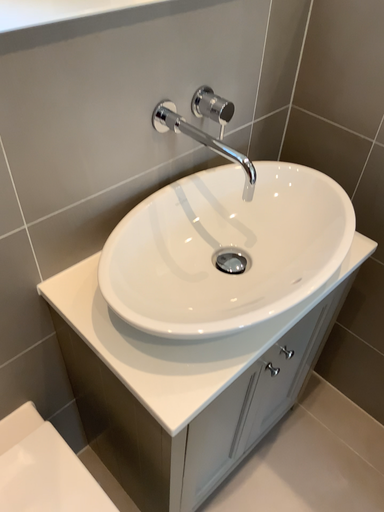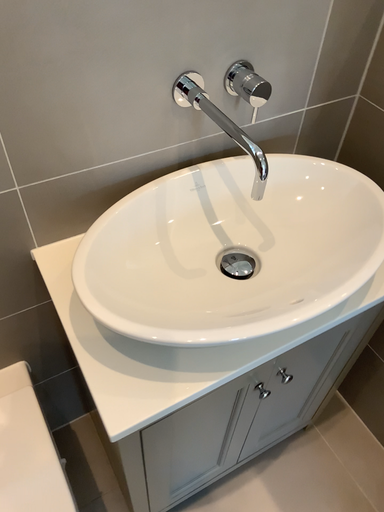
Question: How did the camera likely rotate when shooting the video?

Choices:
 (A) rotated right
 (B) rotated left

Answer: (B)